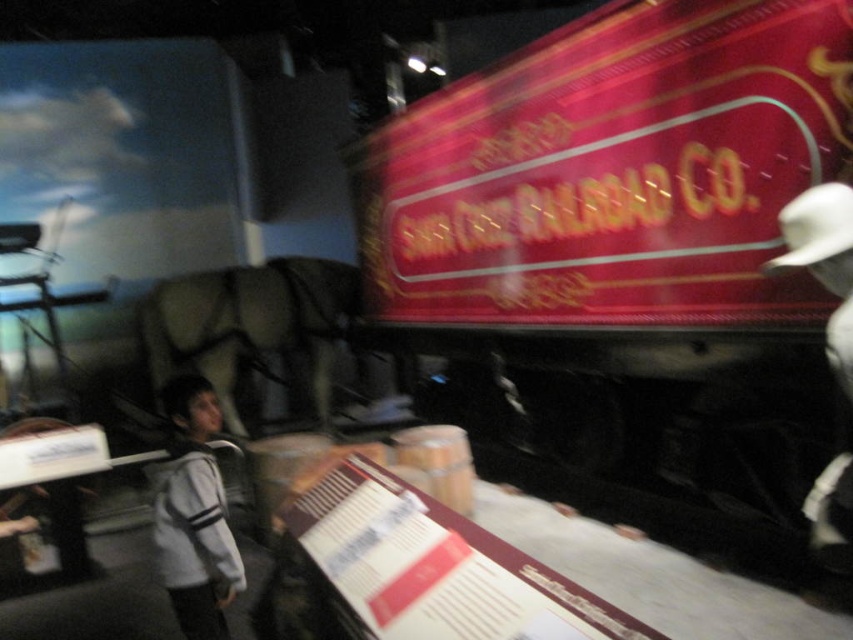
You are a security guard at the museum and need to determine if the gray fleece jacket at left can be placed on a shelf that can only hold items narrower than the white felt hat at right. Can the jacket fit?

The gray fleece jacket at left is wider than the white felt hat at right, so it cannot fit on the shelf designed for items narrower than the white felt hat at right.

In the scene shown: You are a security guard in the museum and need to determine if the gray fleece jacket at left can fully cover the white matte cowboy hat at upper right without overlapping any other objects. Based on their sizes, can the jacket cover the hat?

The gray fleece jacket at left is bigger than the white matte cowboy hat at upper right, so yes, the jacket can fully cover the hat without overlapping other objects.